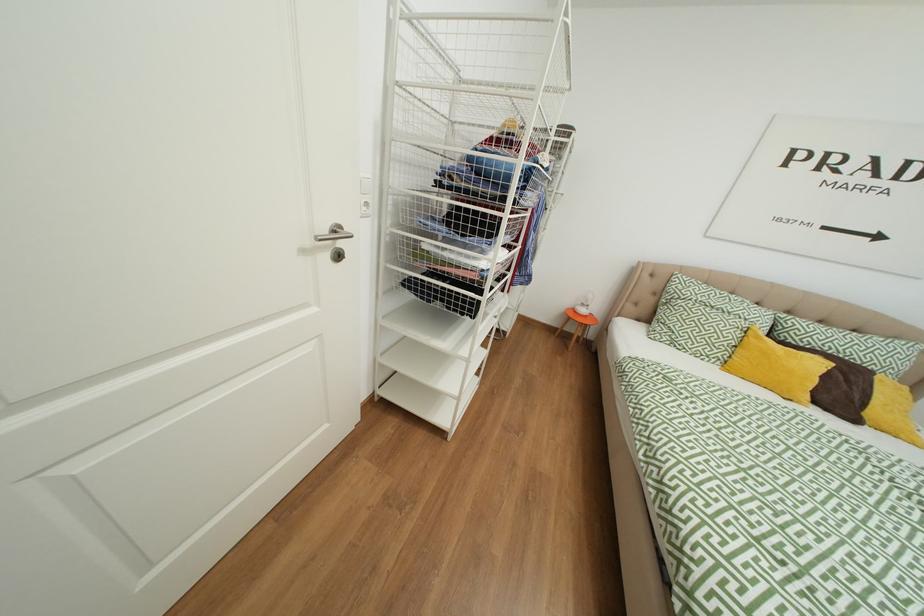
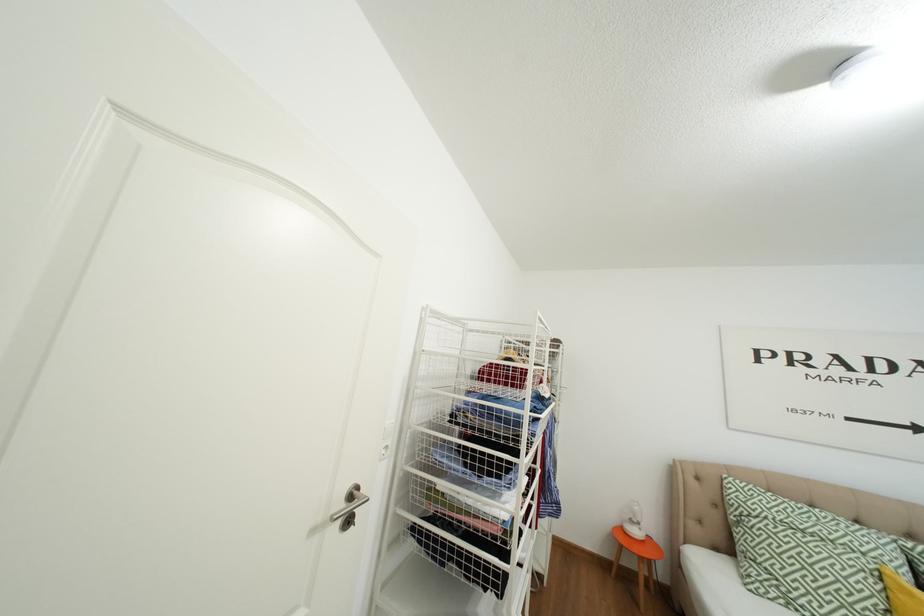
Question: How did the camera likely rotate?

Choices:
 (A) Left
 (B) Right
 (C) Up
 (D) Down

Answer: (C)